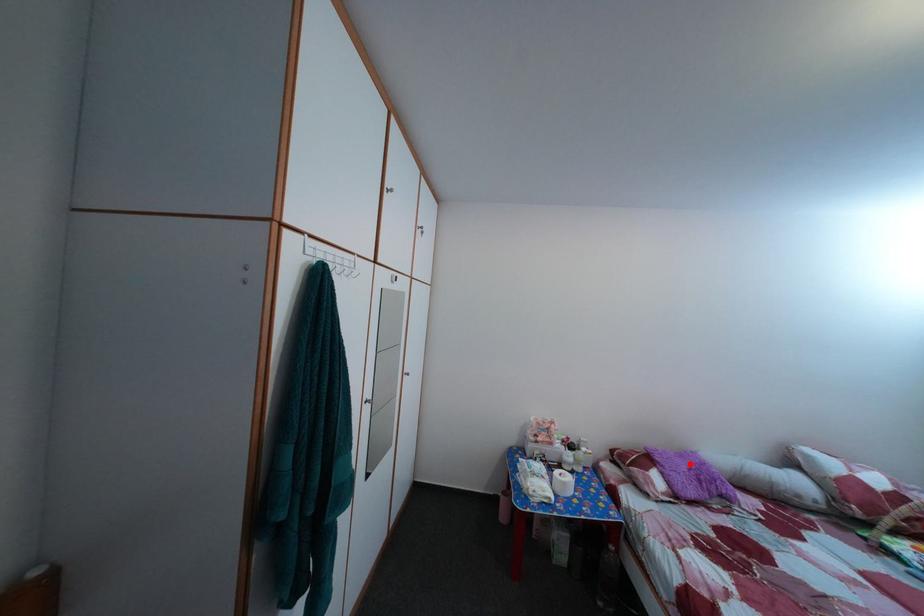
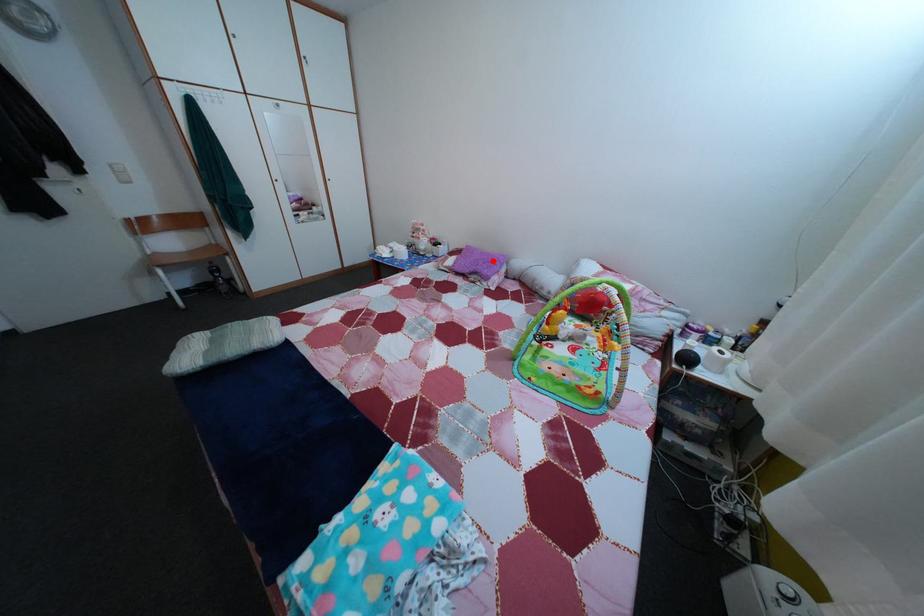
I am providing you with two images of the same scene from different viewpoints. A red point is marked on the first image and another point is marked on the second image. Does the point marked in image1 correspond to the same location as the one in image2?

Yes